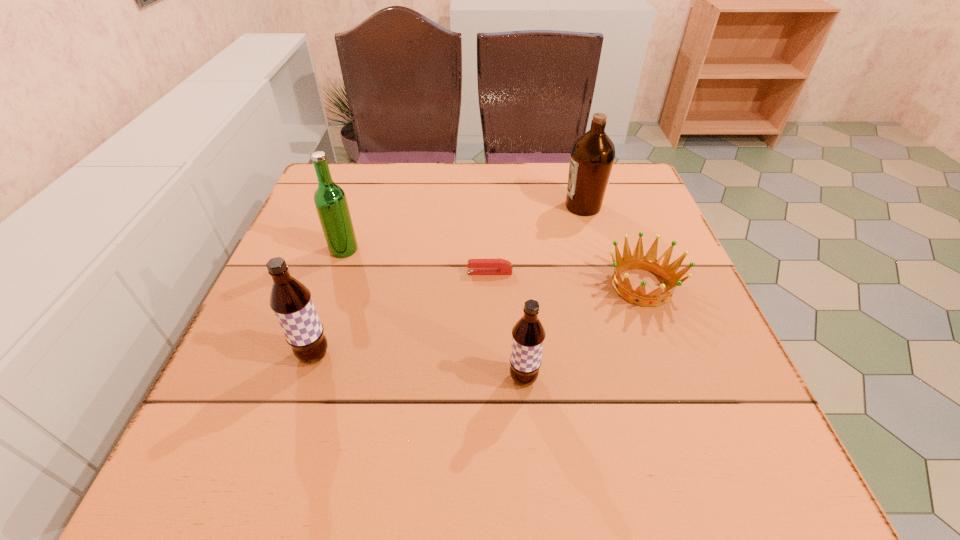
Identify the location of the taller root beer. (291, 301).

You are a GUI agent. You are given a task and a screenshot of the screen. Output one action in this format:
    pyautogui.click(x=<x>, y=<y>)
    Task: Click on the right root beer
    
    Given the screenshot: What is the action you would take?
    pyautogui.click(x=528, y=334)

You are a GUI agent. You are given a task and a screenshot of the screen. Output one action in this format:
    pyautogui.click(x=<x>, y=<y>)
    Task: Click on the fourth tallest object
    
    Given the screenshot: What is the action you would take?
    pyautogui.click(x=528, y=334)

What are the coordinates of `the farthest object` in the screenshot? It's located at (592, 156).

Locate an element on the screen. The width and height of the screenshot is (960, 540). the second shortest object is located at coordinates (649, 262).

At what (x,y) coordinates should I click in order to perform the action: click on stapler. Please return your answer as a coordinate pair (x, y). Looking at the image, I should click on (496, 266).

In order to click on beer bottle in this screenshot , I will do `click(330, 200)`.

Identify the location of blank area located on the front of the taller root beer. (294, 417).

Locate an element on the screen. free space located on the right of the shorter root beer is located at coordinates [636, 378].

Locate an element on the screen. This screenshot has width=960, height=540. free region located 0.250m on the label of the olive oil is located at coordinates pyautogui.click(x=466, y=206).